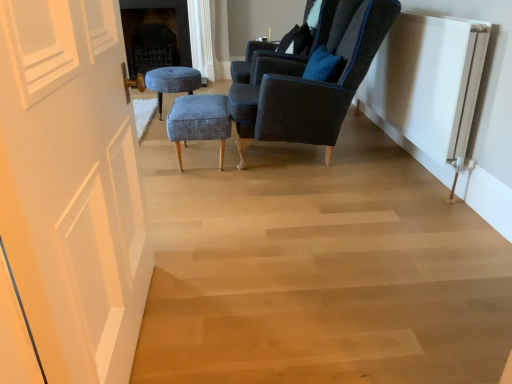
What do you see at coordinates (155, 34) in the screenshot? The width and height of the screenshot is (512, 384). I see `dark gray stone fireplace at upper center` at bounding box center [155, 34].

What do you see at coordinates (428, 82) in the screenshot? The width and height of the screenshot is (512, 384). I see `white ribbed radiator at right` at bounding box center [428, 82].

You are a GUI agent. You are given a task and a screenshot of the screen. Output one action in this format:
    pyautogui.click(x=<x>, y=<y>)
    Task: Click on the velvet dark blue armchair at upper right, positioned as the first chair in back-to-front order
    This screenshot has height=384, width=512.
    Given the screenshot: What is the action you would take?
    pyautogui.click(x=309, y=44)

Describe the element at coordinates (199, 121) in the screenshot. I see `blue fabric stool at center, arranged as the first stool when viewed from the right` at that location.

What is the approximate width of white painted wood door at left?

19.13 centimeters.

Locate an element on the screen. This screenshot has height=384, width=512. dark gray stone fireplace at upper center is located at coordinates 155,34.

Based on the photo, who is bigger, dark gray stone fireplace at upper center or velvet blue stool at center, marked as the 1th stool in a left-to-right arrangement?

With larger size is dark gray stone fireplace at upper center.

Is dark gray stone fireplace at upper center far away from velvet blue stool at center, positioned as the second stool in front-to-back order?

Yes, dark gray stone fireplace at upper center is far from velvet blue stool at center, positioned as the second stool in front-to-back order.

Is dark gray stone fireplace at upper center oriented away from velvet blue stool at center, the second stool from the right?

No, dark gray stone fireplace at upper center's orientation is not away from velvet blue stool at center, the second stool from the right.

From a real-world perspective, is dark gray stone fireplace at upper center physically below velvet blue stool at center, which is counted as the 2th stool, starting from the bottom?

No, from a real-world perspective, dark gray stone fireplace at upper center is not beneath velvet blue stool at center, which is counted as the 2th stool, starting from the bottom.

What are the coordinates of `stool above the blue fabric stool at center, positioned as the 2th stool in back-to-front order (from the image's perspective)` in the screenshot? It's located at (172, 81).

From a real-world perspective, is blue fabric stool at center, arranged as the first stool when viewed from the right, beneath velvet blue stool at center, arranged as the first stool when viewed from the back?

Yes, from a real-world perspective, blue fabric stool at center, arranged as the first stool when viewed from the right, is beneath velvet blue stool at center, arranged as the first stool when viewed from the back.

Would you say blue fabric stool at center, positioned as the 2th stool in back-to-front order, is a long distance from velvet blue stool at center, which appears as the 1th stool when viewed from the top?

They are positioned close to each other.

Is velvet dark blue armchair at upper right, the 2th chair from the front, outside of velvet blue stool at center, which is counted as the 2th stool, starting from the bottom?

Yes, velvet dark blue armchair at upper right, the 2th chair from the front, is not within velvet blue stool at center, which is counted as the 2th stool, starting from the bottom.

Is velvet dark blue armchair at upper right, positioned as the first chair in back-to-front order, looking in the opposite direction of velvet blue stool at center, positioned as the second stool in front-to-back order?

No, velvet blue stool at center, positioned as the second stool in front-to-back order, is not at the back of velvet dark blue armchair at upper right, positioned as the first chair in back-to-front order.

Which object is positioned more to the left, velvet dark blue armchair at upper right, the 2th chair from the front, or velvet blue stool at center, which is counted as the 2th stool, starting from the bottom?

velvet blue stool at center, which is counted as the 2th stool, starting from the bottom, is more to the left.

How many degrees apart are the facing directions of velvet dark blue armchair at upper right, the 2th chair from the front, and velvet blue stool at center, marked as the 1th stool in a left-to-right arrangement?

They differ by 0.000735 degrees in their facing directions.

From the image's perspective, between velvet blue stool at center, which is counted as the 2th stool, starting from the bottom, and white ribbed radiator at right, which one is located above?

velvet blue stool at center, which is counted as the 2th stool, starting from the bottom, from the image's perspective.

Is point (146, 75) positioned behind point (458, 153)?

Yes, it is.

Considering the positions of objects velvet blue stool at center, the second stool from the right, and white ribbed radiator at right in the image provided, who is more to the left, velvet blue stool at center, the second stool from the right, or white ribbed radiator at right?

velvet blue stool at center, the second stool from the right.

Based on the photo, how distant is velvet blue stool at center, arranged as the first stool when viewed from the back, from white ribbed radiator at right?

velvet blue stool at center, arranged as the first stool when viewed from the back, and white ribbed radiator at right are 1.78 meters apart.

From a real-world perspective, is velvet dark blue armchair at upper right, positioned as the first chair in back-to-front order, below velvet dark blue armchair at center, the 1th chair viewed from the front?

No, from a real-world perspective, velvet dark blue armchair at upper right, positioned as the first chair in back-to-front order, is not beneath velvet dark blue armchair at center, the 1th chair viewed from the front.

Considering the relative sizes of velvet dark blue armchair at upper right, the 2th chair from the front, and velvet dark blue armchair at center, marked as the second chair in a back-to-front arrangement, in the image provided, is velvet dark blue armchair at upper right, the 2th chair from the front, taller than velvet dark blue armchair at center, marked as the second chair in a back-to-front arrangement,?

In fact, velvet dark blue armchair at upper right, the 2th chair from the front, may be shorter than velvet dark blue armchair at center, marked as the second chair in a back-to-front arrangement.

In the scene shown: Is velvet dark blue armchair at upper right, the 2th chair from the front, oriented away from velvet dark blue armchair at center, marked as the second chair in a back-to-front arrangement?

No, velvet dark blue armchair at upper right, the 2th chair from the front, is not facing the opposite direction of velvet dark blue armchair at center, marked as the second chair in a back-to-front arrangement.

Does point (248, 64) come farther from viewer compared to point (244, 93)?

That is True.

From the image's perspective, is white painted wood door at left on top of white ribbed radiator at right?

No, from the image's perspective, white painted wood door at left is not on top of white ribbed radiator at right.

I want to click on door that is below the white ribbed radiator at right (from the image's perspective), so click(72, 186).

Which is in front, white painted wood door at left or white ribbed radiator at right?

Positioned in front is white painted wood door at left.

Is white painted wood door at left spatially inside white ribbed radiator at right, or outside of it?

white painted wood door at left lies outside white ribbed radiator at right.

Considering the sizes of objects velvet blue stool at center, the second stool from the right, and dark gray stone fireplace at upper center in the image provided, who is taller, velvet blue stool at center, the second stool from the right, or dark gray stone fireplace at upper center?

Answer: dark gray stone fireplace at upper center.

Choose the correct answer: Is velvet blue stool at center, which appears as the 1th stool when viewed from the top, inside dark gray stone fireplace at upper center or outside it?

velvet blue stool at center, which appears as the 1th stool when viewed from the top, is spatially situated outside dark gray stone fireplace at upper center.

From a real-world perspective, starting from the dark gray stone fireplace at upper center, which stool is the 1st one below it? Please provide its 2D coordinates.

[(172, 81)]

Considering the relative sizes of velvet blue stool at center, marked as the 1th stool in a left-to-right arrangement, and dark gray stone fireplace at upper center in the image provided, is velvet blue stool at center, marked as the 1th stool in a left-to-right arrangement, wider than dark gray stone fireplace at upper center?

Indeed, velvet blue stool at center, marked as the 1th stool in a left-to-right arrangement, has a greater width compared to dark gray stone fireplace at upper center.

Locate an element on the screen. This screenshot has height=384, width=512. fireplace above the velvet blue stool at center, which appears as the 1th stool when viewed from the top (from the image's perspective) is located at coordinates (155, 34).

Where is `stool located behind the blue fabric stool at center, arranged as the first stool when viewed from the right`? stool located behind the blue fabric stool at center, arranged as the first stool when viewed from the right is located at coordinates (172, 81).

Which object lies further to the anchor point white ribbed radiator at right, white painted wood door at left or velvet dark blue armchair at upper right, the 2th chair from the front?

Among the two, white painted wood door at left is located further to white ribbed radiator at right.

Which object lies further to the anchor point white ribbed radiator at right, velvet dark blue armchair at upper right, the 2th chair from the front, or velvet dark blue armchair at center, the 1th chair viewed from the front?

Based on the image, velvet dark blue armchair at upper right, the 2th chair from the front, appears to be further to white ribbed radiator at right.

When comparing their distances from velvet dark blue armchair at center, the 1th chair viewed from the front, does blue fabric stool at center, positioned as the 2th stool in back-to-front order, or white painted wood door at left seem closer?

Based on the image, blue fabric stool at center, positioned as the 2th stool in back-to-front order, appears to be nearer to velvet dark blue armchair at center, the 1th chair viewed from the front.

When comparing their distances from white ribbed radiator at right, does velvet dark blue armchair at upper right, positioned as the first chair in back-to-front order, or blue fabric stool at center, arranged as the first stool when viewed from the right, seem further?

The object further to white ribbed radiator at right is blue fabric stool at center, arranged as the first stool when viewed from the right.

Estimate the real-world distances between objects in this image. Which object is further from velvet blue stool at center, which is counted as the 2th stool, starting from the bottom, white painted wood door at left or dark gray stone fireplace at upper center?

white painted wood door at left is positioned further to the anchor velvet blue stool at center, which is counted as the 2th stool, starting from the bottom.

Which object lies nearer to the anchor point white painted wood door at left, velvet dark blue armchair at center, the 1th chair viewed from the front, or velvet dark blue armchair at upper right, positioned as the first chair in back-to-front order?

velvet dark blue armchair at center, the 1th chair viewed from the front, lies closer to white painted wood door at left than the other object.

Considering their positions, is velvet dark blue armchair at upper right, the 2th chair from the front, positioned closer to velvet blue stool at center, positioned as the second stool in front-to-back order, than white ribbed radiator at right?

The object closer to velvet blue stool at center, positioned as the second stool in front-to-back order, is velvet dark blue armchair at upper right, the 2th chair from the front.

Estimate the real-world distances between objects in this image. Which object is further from velvet blue stool at center, marked as the 1th stool in a left-to-right arrangement, white painted wood door at left or velvet dark blue armchair at center, the 1th chair viewed from the front?

Based on the image, white painted wood door at left appears to be further to velvet blue stool at center, marked as the 1th stool in a left-to-right arrangement.

I want to click on chair positioned between white painted wood door at left and blue fabric stool at center, positioned as the 2th stool in back-to-front order, from near to far, so pos(309,87).

The image size is (512, 384). I want to click on stool between velvet dark blue armchair at center, marked as the second chair in a back-to-front arrangement, and velvet dark blue armchair at upper right, positioned as the first chair in back-to-front order, in the front-back direction, so click(x=199, y=121).

Find the location of a particular element. Image resolution: width=512 pixels, height=384 pixels. stool between velvet dark blue armchair at center, marked as the second chair in a back-to-front arrangement, and velvet blue stool at center, marked as the 1th stool in a left-to-right arrangement, from front to back is located at coordinates (199, 121).

You are a GUI agent. You are given a task and a screenshot of the screen. Output one action in this format:
    pyautogui.click(x=<x>, y=<y>)
    Task: Click on the chair between velvet dark blue armchair at center, the 1th chair viewed from the front, and velvet blue stool at center, arranged as the first stool when viewed from the back, from front to back
    The height and width of the screenshot is (384, 512).
    Given the screenshot: What is the action you would take?
    pyautogui.click(x=309, y=44)